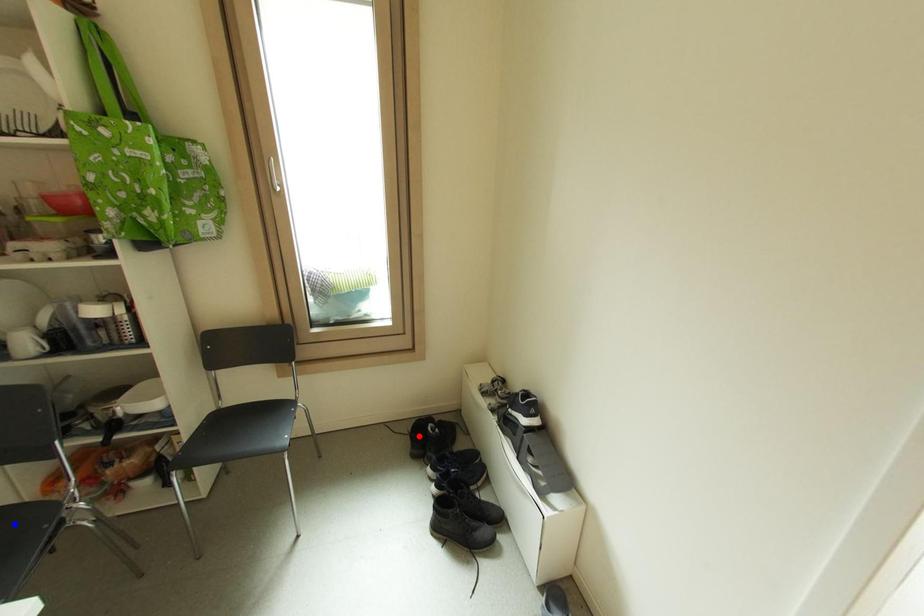
Question: Which of the two points in the image is closer to the camera?

Choices:
 (A) Blue point is closer.
 (B) Red point is closer.

Answer: (A)